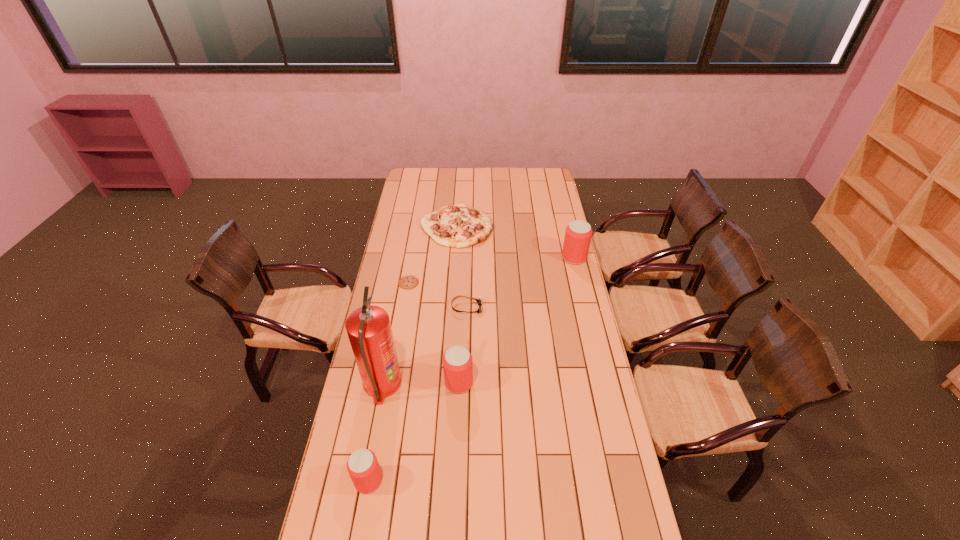
Where is `free area in between the pizza and the fire extinguisher`? This screenshot has height=540, width=960. free area in between the pizza and the fire extinguisher is located at coordinates (420, 305).

You are a GUI agent. You are given a task and a screenshot of the screen. Output one action in this format:
    pyautogui.click(x=<x>, y=<y>)
    Task: Click on the vacant space that's between the shortest object and the farthest object
    This screenshot has height=540, width=960.
    Given the screenshot: What is the action you would take?
    pyautogui.click(x=433, y=254)

Identify the location of free area in between the shortest object and the second shortest beer can. (434, 333).

Find the location of a particular element. vacant point located between the second beer can from right to left and the fourth nearest object is located at coordinates (463, 345).

This screenshot has height=540, width=960. I want to click on vacant area between the sixth nearest object and the goggles, so click(520, 282).

What are the coordinates of `vacant region between the cookie and the pizza` in the screenshot? It's located at (433, 254).

In order to click on vacant area that lies between the fire extinguisher and the farthest object in this screenshot , I will do `click(420, 305)`.

Locate an element on the screen. This screenshot has width=960, height=540. free space that is in between the fourth shortest object and the fire extinguisher is located at coordinates (375, 432).

Select which object appears as the second closest to the second tallest beer can. Please provide its 2D coordinates. Your answer should be formatted as a tuple, i.e. [(x, y)], where the tuple contains the x and y coordinates of a point satisfying the conditions above.

[(479, 301)]

Identify which object is the third nearest to the fire extinguisher. Please provide its 2D coordinates. Your answer should be formatted as a tuple, i.e. [(x, y)], where the tuple contains the x and y coordinates of a point satisfying the conditions above.

[(479, 301)]